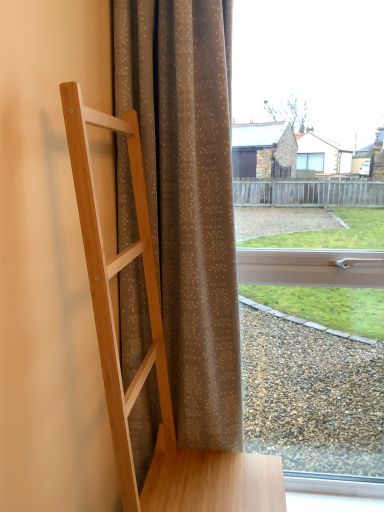
Question: Is the depth of brown sheer curtain at center greater than that of transparent glass window at center?

Choices:
 (A) no
 (B) yes

Answer: (A)

Question: From a real-world perspective, is brown sheer curtain at center under transparent glass window at center?

Choices:
 (A) no
 (B) yes

Answer: (A)

Question: Is brown sheer curtain at center taller than transparent glass window at center?

Choices:
 (A) yes
 (B) no

Answer: (B)

Question: Can you confirm if brown sheer curtain at center is wider than transparent glass window at center?

Choices:
 (A) no
 (B) yes

Answer: (B)

Question: Is brown sheer curtain at center located outside transparent glass window at center?

Choices:
 (A) no
 (B) yes

Answer: (B)

Question: Considering their positions, is transparent glass window at center located in front of or behind brown sheer curtain at center?

Choices:
 (A) behind
 (B) front

Answer: (A)

Question: Is transparent glass window at center inside the boundaries of brown sheer curtain at center, or outside?

Choices:
 (A) outside
 (B) inside

Answer: (A)

Question: In terms of width, does transparent glass window at center look wider or thinner when compared to brown sheer curtain at center?

Choices:
 (A) wide
 (B) thin

Answer: (B)

Question: Is point (380, 403) positioned closer to the camera than point (205, 36)?

Choices:
 (A) closer
 (B) farther

Answer: (B)

Question: In the image, is brown sheer curtain at center on the left side or the right side of natural wood ladder at left?

Choices:
 (A) right
 (B) left

Answer: (B)

Question: From a real-world perspective, is brown sheer curtain at center positioned above or below natural wood ladder at left?

Choices:
 (A) above
 (B) below

Answer: (A)

Question: Is brown sheer curtain at center wider or thinner than natural wood ladder at left?

Choices:
 (A) thin
 (B) wide

Answer: (A)

Question: From their relative heights in the image, would you say brown sheer curtain at center is taller or shorter than natural wood ladder at left?

Choices:
 (A) short
 (B) tall

Answer: (B)

Question: From their relative heights in the image, would you say natural wood ladder at left is taller or shorter than transparent glass window at center?

Choices:
 (A) tall
 (B) short

Answer: (B)

Question: From the image's perspective, is natural wood ladder at left located above or below transparent glass window at center?

Choices:
 (A) below
 (B) above

Answer: (A)